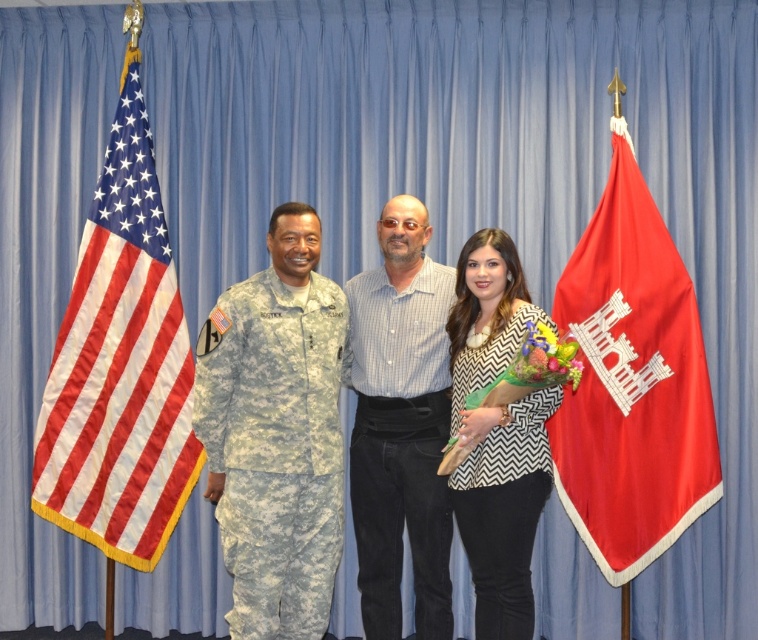
Question: Which of the following is the farthest from the observer?

Choices:
 (A) camouflage fabric uniform at left
 (B) red satin flag at right
 (C) glossy floral bouquet at center
 (D) white zigzag-patterned blouse at center

Answer: (B)

Question: Can you confirm if silky cotton flag at left is bigger than glossy floral bouquet at center?

Choices:
 (A) no
 (B) yes

Answer: (B)

Question: Can you confirm if camouflage fabric uniform at left is positioned above white striped shirt at center?

Choices:
 (A) no
 (B) yes

Answer: (A)

Question: Which is nearer to the camouflage fabric uniform at left?

Choices:
 (A) white striped shirt at center
 (B) red satin flag at right
 (C) camouflage uniform at center

Answer: (A)

Question: Which point is closer to the camera?

Choices:
 (A) (403, 248)
 (B) (489, 484)
 (C) (130, 209)

Answer: (B)

Question: Does red satin flag at right have a smaller size compared to glossy floral bouquet at center?

Choices:
 (A) yes
 (B) no

Answer: (B)